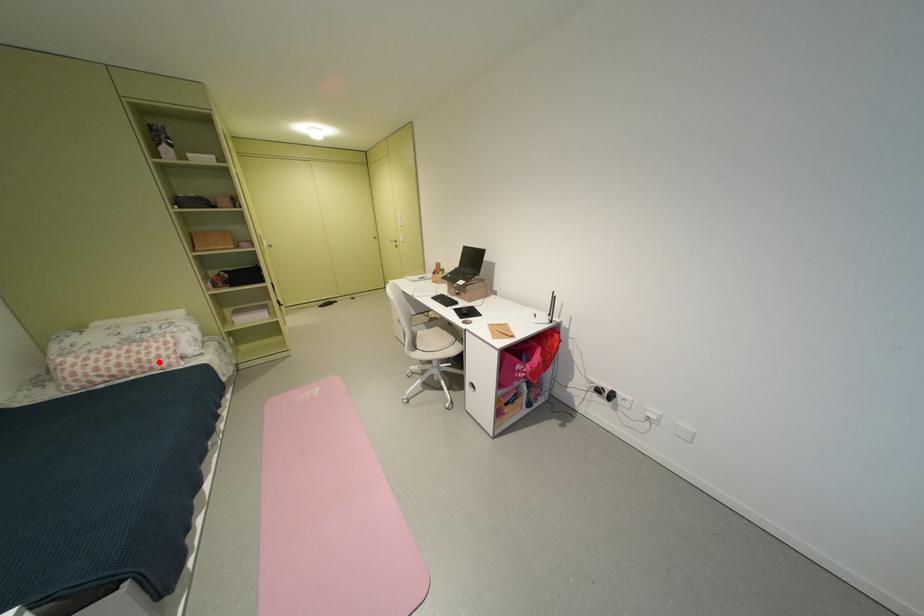
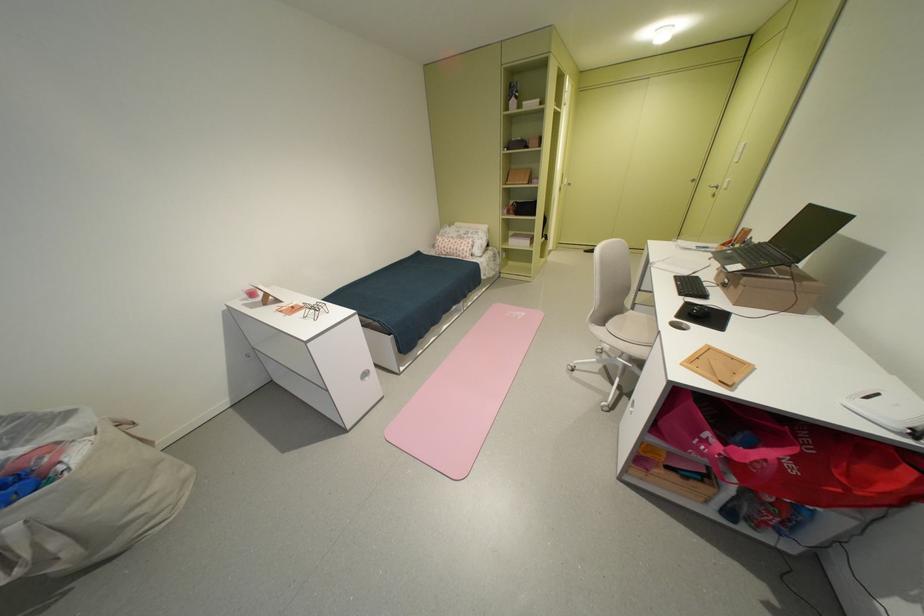
Find the pixel in the second image that matches the highlighted location in the first image.

(468, 252)